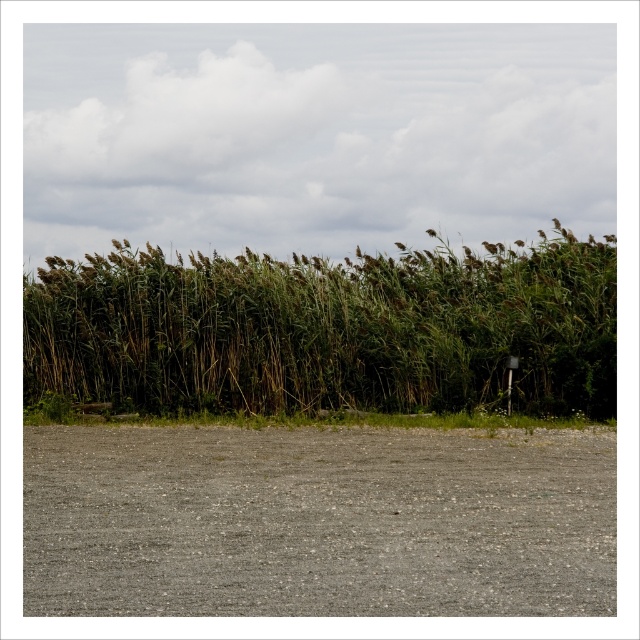
Question: Can you confirm if gray gravelly dirt field at lower center is wider than green grassy reeds at upper center?

Choices:
 (A) yes
 (B) no

Answer: (B)

Question: Which point appears closest to the camera in this image?

Choices:
 (A) click(x=588, y=252)
 (B) click(x=310, y=420)
 (C) click(x=67, y=477)

Answer: (C)

Question: Is gray gravelly dirt field at lower center positioned behind green grassy reeds at upper center?

Choices:
 (A) yes
 (B) no

Answer: (B)

Question: Which point is closer to the camera?

Choices:
 (A) green grassy reeds at upper center
 (B) gray gravelly dirt field at lower center
 (C) green grass at bottom

Answer: (B)

Question: Which of the following is the farthest from the observer?

Choices:
 (A) (241, 593)
 (B) (488, 342)

Answer: (B)

Question: Is the position of gray gravelly dirt field at lower center less distant than that of green grass at bottom?

Choices:
 (A) yes
 (B) no

Answer: (A)